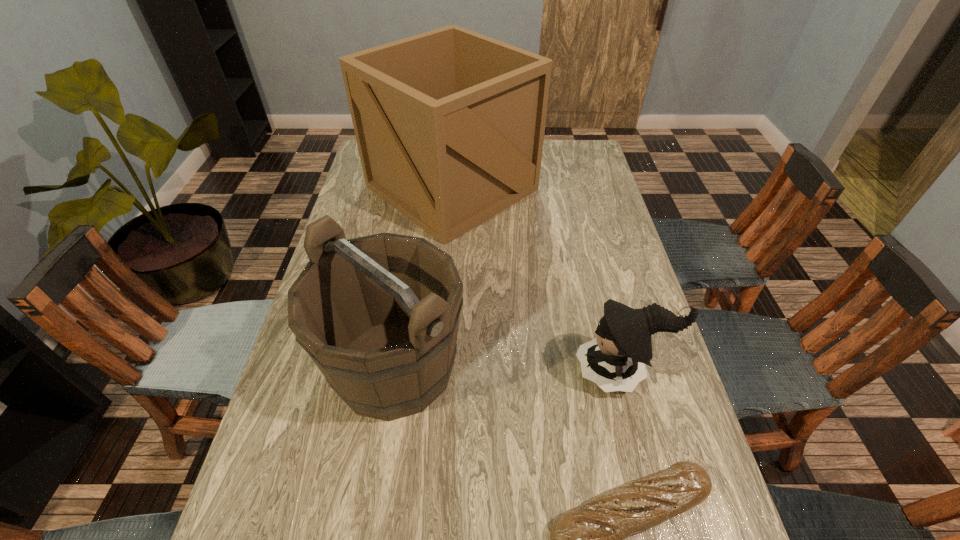
This screenshot has height=540, width=960. I want to click on box, so click(x=449, y=124).

You are a GUI agent. You are given a task and a screenshot of the screen. Output one action in this format:
    pyautogui.click(x=<x>, y=<y>)
    Task: Click on the farthest object
    
    Given the screenshot: What is the action you would take?
    pyautogui.click(x=449, y=124)

You are a GUI agent. You are given a task and a screenshot of the screen. Output one action in this format:
    pyautogui.click(x=<x>, y=<y>)
    Task: Click on the bucket
    Image resolution: width=960 pixels, height=540 pixels.
    Given the screenshot: What is the action you would take?
    pyautogui.click(x=379, y=315)

Where is `doll`? This screenshot has width=960, height=540. doll is located at coordinates (614, 360).

The width and height of the screenshot is (960, 540). I want to click on free point located 0.050m on the front of the tallest object, so click(x=446, y=255).

The image size is (960, 540). I want to click on free space located 0.380m on the back of the third shortest object, so click(417, 221).

Find the location of a particular element. free region located at the face of the third tallest object is located at coordinates (425, 372).

Locate an element on the screen. The width and height of the screenshot is (960, 540). free point located 0.110m at the face of the third tallest object is located at coordinates (530, 372).

This screenshot has height=540, width=960. I want to click on blank space located 0.150m at the face of the third tallest object, so click(x=513, y=372).

The height and width of the screenshot is (540, 960). Identify the location of object that is at the far edge. (449, 124).